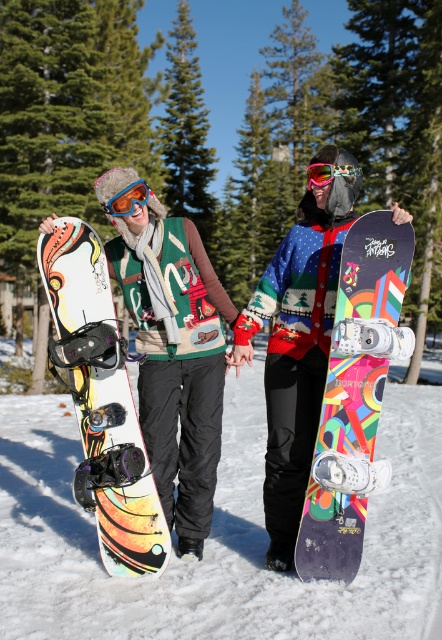
You are a photographer standing at the edge of a snowy slope. You want to take a closeup shot of the matte black snowboard at center without moving closer than 3 meters. Is the current distance sufficient?

The matte black snowboard at center is 3.38 meters away from the camera, which is just over the 3 meter minimum distance required for the closeup shot. Therefore, the photographer can take the photo without moving closer.

You are planning to carry both the matte black snowboard at center and the matte snowboard at left into a cabin with a narrow doorway. Which snowboard should you take first to ensure it fits through the doorway?

The matte snowboard at left should be taken first because it is narrower than the matte black snowboard at center, which is wider and might not fit through the narrow doorway.

You are planning to take a photo of the green textured pine trees at upper center and the matte multicolored snowboard at left. Since the pine trees are above the snowboard, where should you position your camera to capture both in the frame?

To capture both the green textured pine trees at upper center and the matte multicolored snowboard at left in the frame, position the camera so it can see upwards towards the pine trees while still framing the snowboard below. Since the green textured pine trees at upper center are located above the matte multicolored snowboard at left, angling the camera upwards would include both elements in the shot.